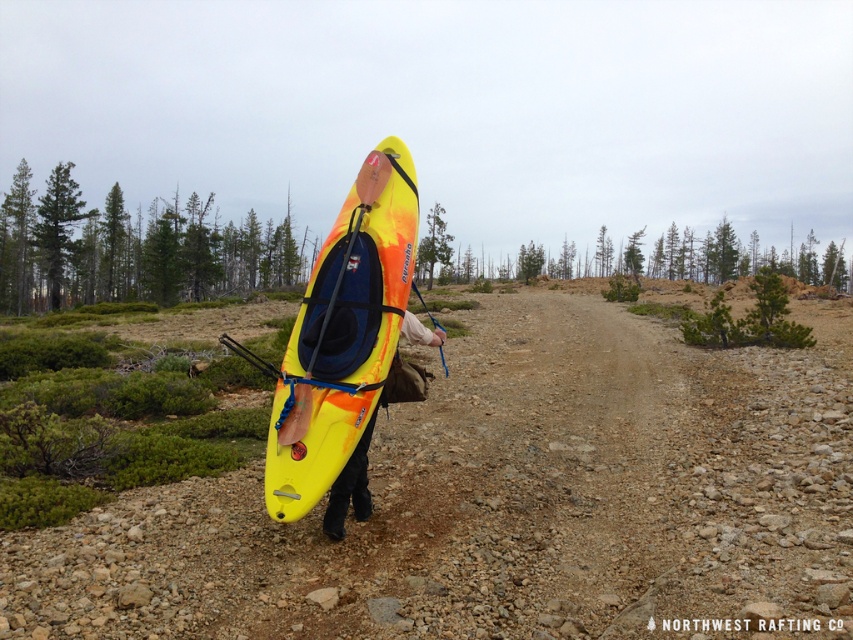
Question: Which of the following is the closest to the observer?

Choices:
 (A) (335, 419)
 (B) (566, 352)

Answer: (A)

Question: Estimate the real-world distances between objects in this image. Which object is closer to the yellow matte kayak at center?

Choices:
 (A) yellow plastic kayak at center
 (B) dirtgravelly/granulartrack at center

Answer: (A)

Question: Among these objects, which one is nearest to the camera?

Choices:
 (A) dirtgravelly/granulartrack at center
 (B) yellow plastic kayak at center
 (C) yellow matte kayak at center

Answer: (A)

Question: Does dirtgravelly/granulartrack at center have a larger size compared to yellow matte kayak at center?

Choices:
 (A) no
 (B) yes

Answer: (B)

Question: Does dirtgravelly/granulartrack at center have a greater width compared to yellow matte kayak at center?

Choices:
 (A) no
 (B) yes

Answer: (B)

Question: Is dirtgravelly/granulartrack at center below yellow plastic kayak at center?

Choices:
 (A) yes
 (B) no

Answer: (B)